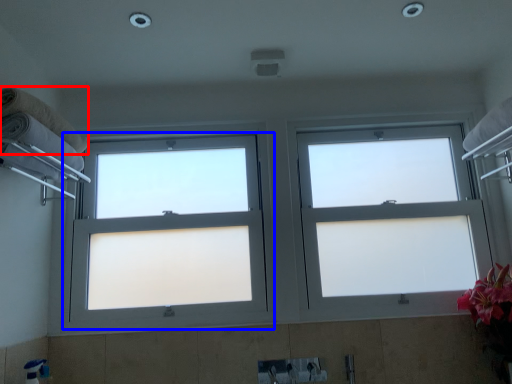
Question: Which point is further to the camera, towel (highlighted by a red box) or window (highlighted by a blue box)?

Choices:
 (A) towel
 (B) window

Answer: (B)